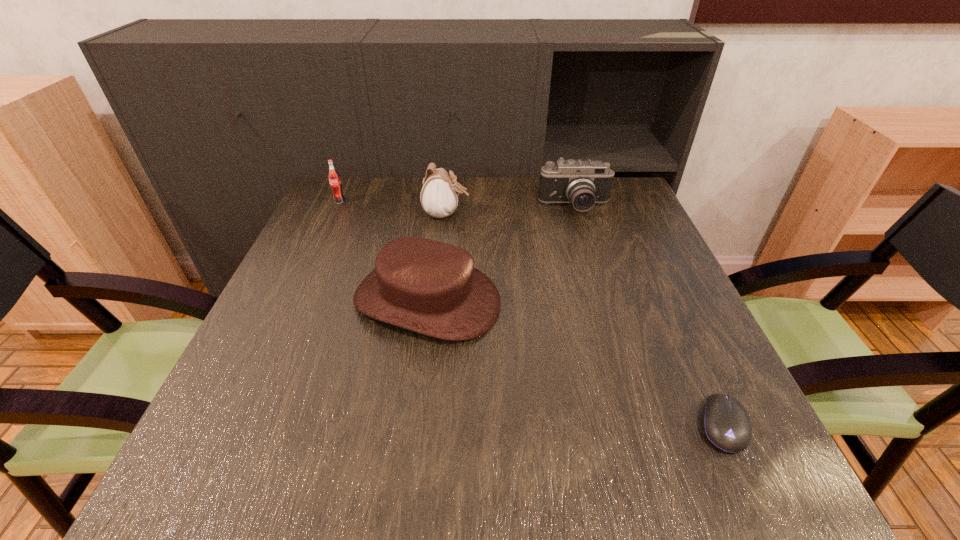
Locate an element on the screen. This screenshot has height=540, width=960. unoccupied area between the shortest object and the pouch is located at coordinates (585, 320).

Identify the location of unoccupied area between the nearest object and the hat. This screenshot has height=540, width=960. (575, 363).

Find the location of a particular element. This screenshot has width=960, height=540. vacant area between the pouch and the leftmost object is located at coordinates (393, 207).

Select which object is the second closest to the fourth farthest object. Please provide its 2D coordinates. Your answer should be formatted as a tuple, i.e. [(x, y)], where the tuple contains the x and y coordinates of a point satisfying the conditions above.

[(582, 183)]

You are a GUI agent. You are given a task and a screenshot of the screen. Output one action in this format:
    pyautogui.click(x=<x>, y=<y>)
    Task: Click on the fourth closest object to the pouch
    The image size is (960, 540).
    Given the screenshot: What is the action you would take?
    pyautogui.click(x=726, y=424)

Where is `free space that satisfies the following two spatial constraints: 1. on the label of the nearest object; 2. on the right side of the leftmost object`? free space that satisfies the following two spatial constraints: 1. on the label of the nearest object; 2. on the right side of the leftmost object is located at coordinates (238, 426).

Identify the location of blank area in the image that satisfies the following two spatial constraints: 1. on the front-facing side of the pouch; 2. on the left side of the shortest object. Image resolution: width=960 pixels, height=540 pixels. [x=423, y=426].

Where is `vacant space that satisfies the following two spatial constraints: 1. on the front-facing side of the camera; 2. on the right side of the shortest object`? vacant space that satisfies the following two spatial constraints: 1. on the front-facing side of the camera; 2. on the right side of the shortest object is located at coordinates pyautogui.click(x=640, y=426).

Where is `free point that satisfies the following two spatial constraints: 1. on the label of the leftmost object; 2. on the left side of the computer mouse`? The width and height of the screenshot is (960, 540). free point that satisfies the following two spatial constraints: 1. on the label of the leftmost object; 2. on the left side of the computer mouse is located at coordinates click(238, 426).